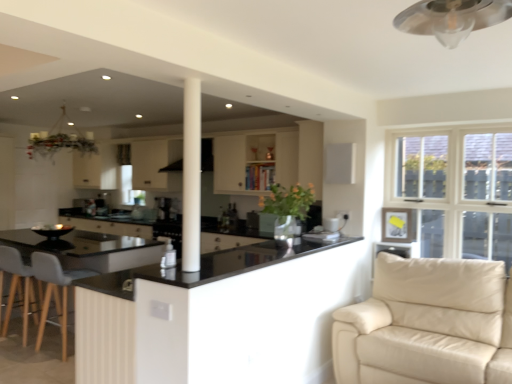
Question: In terms of size, does white fabric curtain at upper center appear bigger or smaller than beige leather couch at lower right?

Choices:
 (A) big
 (B) small

Answer: (B)

Question: From a real-world perspective, is white fabric curtain at upper center physically located above or below beige leather couch at lower right?

Choices:
 (A) below
 (B) above

Answer: (B)

Question: Which is farther from the gray fabric swivel chair at lower left?

Choices:
 (A) white smooth column at center
 (B) metallic silver mechanical fan at upper center
 (C) light gray fabric chair at lower left
 (D) white fabric curtain at upper center
 (E) beige leather couch at lower right

Answer: (B)

Question: Considering the real-world distances, which object is closest to the satin black coffee machine at center?

Choices:
 (A) metallic silver mechanical fan at upper center
 (B) black glossy countertop at center, which is counted as the second countertop, starting from the top
 (C) black glossy countertop at center, the 1th countertop viewed from the top
 (D) black matte exhaust hood at center
 (E) light gray fabric chair at lower left

Answer: (D)